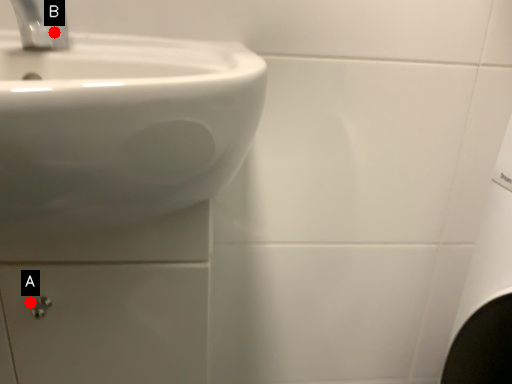
Question: Two points are circled on the image, labeled by A and B beside each circle. Among these points, which one is nearest to the camera?

Choices:
 (A) A is closer
 (B) B is closer

Answer: (A)